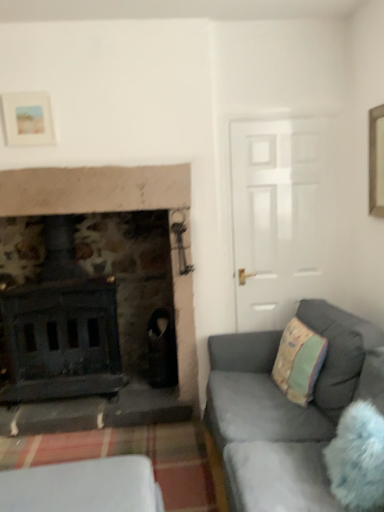
Question: Is white plastic container at lower left closer to camera compared to velvet grey couch at lower right?

Choices:
 (A) yes
 (B) no

Answer: (B)

Question: From the image's perspective, is white plastic container at lower left below velvet grey couch at lower right?

Choices:
 (A) yes
 (B) no

Answer: (A)

Question: Can you confirm if white plastic container at lower left is shorter than velvet grey couch at lower right?

Choices:
 (A) no
 (B) yes

Answer: (B)

Question: Considering the relative sizes of white plastic container at lower left and velvet grey couch at lower right in the image provided, is white plastic container at lower left thinner than velvet grey couch at lower right?

Choices:
 (A) yes
 (B) no

Answer: (A)

Question: Is white plastic container at lower left bigger than velvet grey couch at lower right?

Choices:
 (A) yes
 (B) no

Answer: (B)

Question: From a real-world perspective, is matte white picture frame at upper left physically located above or below white plastic container at lower left?

Choices:
 (A) below
 (B) above

Answer: (B)

Question: Based on their positions, is matte white picture frame at upper left located to the left or right of white plastic container at lower left?

Choices:
 (A) right
 (B) left

Answer: (B)

Question: In terms of size, does matte white picture frame at upper left appear bigger or smaller than white plastic container at lower left?

Choices:
 (A) small
 (B) big

Answer: (A)

Question: In terms of width, does matte white picture frame at upper left look wider or thinner when compared to white plastic container at lower left?

Choices:
 (A) thin
 (B) wide

Answer: (A)

Question: In terms of width, does velvet grey couch at lower right look wider or thinner when compared to fluffy white pillow at lower right?

Choices:
 (A) wide
 (B) thin

Answer: (A)

Question: Is velvet grey couch at lower right in front of or behind fluffy white pillow at lower right in the image?

Choices:
 (A) behind
 (B) front

Answer: (B)

Question: From the image's perspective, is velvet grey couch at lower right located above or below fluffy white pillow at lower right?

Choices:
 (A) below
 (B) above

Answer: (A)

Question: From a real-world perspective, is velvet grey couch at lower right above or below fluffy white pillow at lower right?

Choices:
 (A) above
 (B) below

Answer: (B)

Question: Do you think white plastic container at lower left is within fluffy white pillow at lower right, or outside of it?

Choices:
 (A) inside
 (B) outside

Answer: (B)

Question: From a real-world perspective, is white plastic container at lower left physically located above or below fluffy white pillow at lower right?

Choices:
 (A) above
 (B) below

Answer: (B)